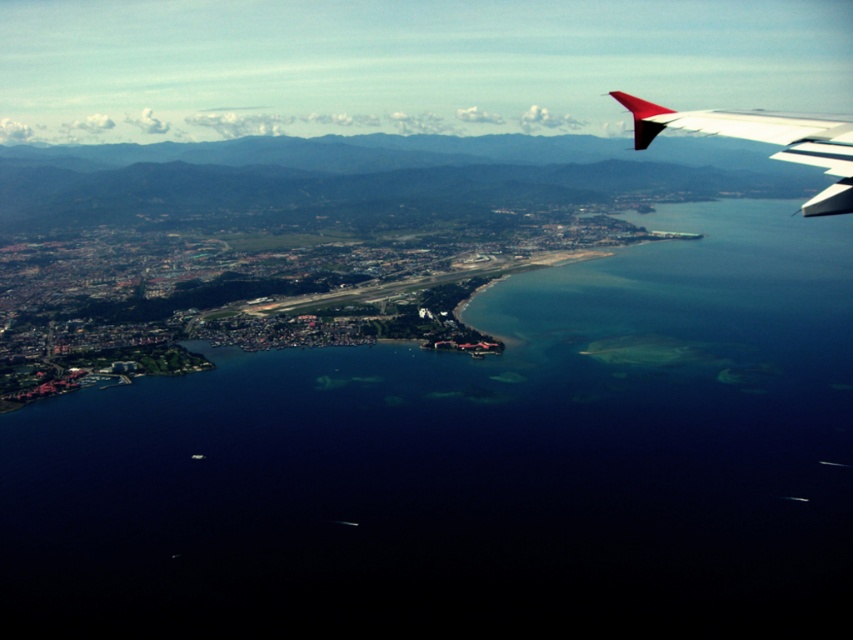
Is point (811, 275) behind point (831, 136)?

That is True.

This screenshot has width=853, height=640. What are the coordinates of `clear blue water at center` in the screenshot? It's located at (474, 465).